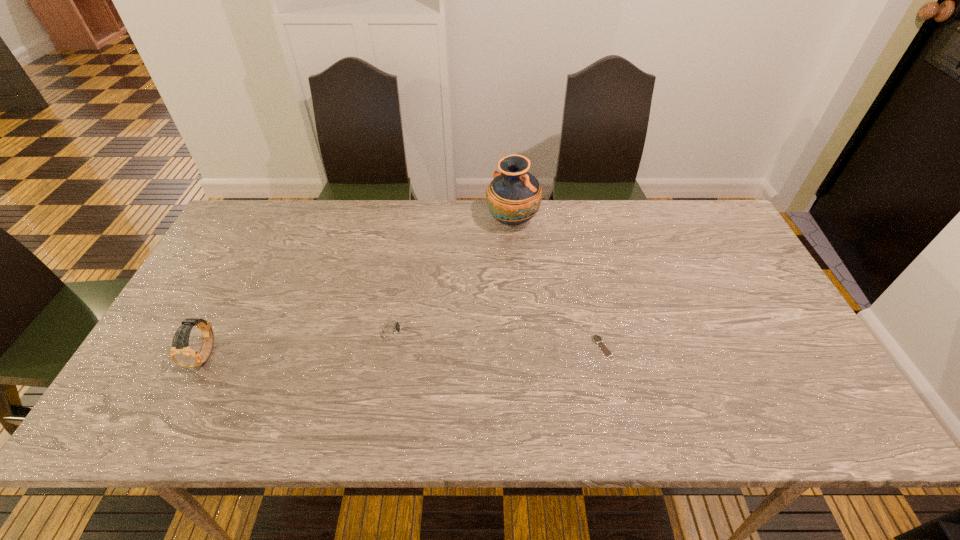
The width and height of the screenshot is (960, 540). In order to click on free point between the tallest object and the third shortest object in this screenshot , I will do `click(359, 288)`.

Find the location of a particular element. empty space between the second shortest object and the second object from right to left is located at coordinates (452, 275).

The width and height of the screenshot is (960, 540). In order to click on free spot between the third shortest object and the rightmost object in this screenshot , I will do `click(404, 351)`.

You are a GUI agent. You are given a task and a screenshot of the screen. Output one action in this format:
    pyautogui.click(x=<x>, y=<y>)
    Task: Click on the free space between the tallest object and the leftmost object
    
    Given the screenshot: What is the action you would take?
    coord(359,288)

This screenshot has height=540, width=960. What are the coordinates of `free space between the tallest watch and the second watch from right to left` in the screenshot? It's located at (299, 342).

At what (x,y) coordinates should I click in order to perform the action: click on unoccupied position between the tallest object and the second shortest object. Please return your answer as a coordinate pair (x, y). Looking at the image, I should click on (452, 275).

You are a GUI agent. You are given a task and a screenshot of the screen. Output one action in this format:
    pyautogui.click(x=<x>, y=<y>)
    Task: Click on the free spot between the second watch from left to right and the rightmost watch
    The width and height of the screenshot is (960, 540).
    Given the screenshot: What is the action you would take?
    pyautogui.click(x=497, y=339)

Identify the location of vacant area between the leftmost watch and the shortest watch. (404, 351).

Where is `vacant area that lies between the tallest object and the second shortest watch`? vacant area that lies between the tallest object and the second shortest watch is located at coordinates (452, 275).

At what (x,y) coordinates should I click in order to perform the action: click on free point between the farthest object and the second tallest object. Please return your answer as a coordinate pair (x, y). Looking at the image, I should click on coord(359,288).